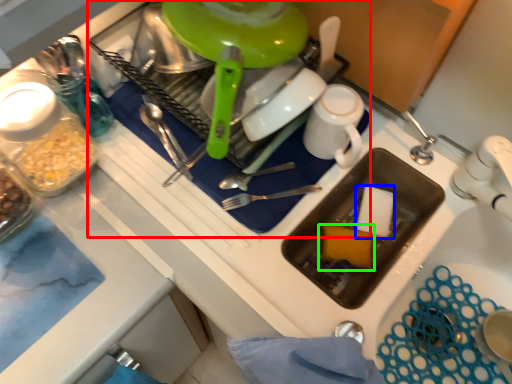
Question: Which object is the closest to the appliance (highlighted by a red box)? Choose among these: food (highlighted by a blue box) or food (highlighted by a green box).

Choices:
 (A) food
 (B) food

Answer: (B)